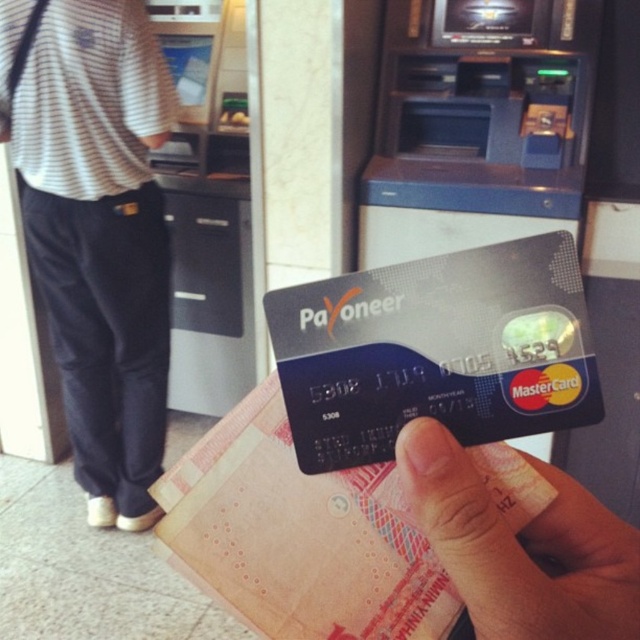
Question: Does striped cotton shirt at upper left appear over smooth skin hand at center?

Choices:
 (A) no
 (B) yes

Answer: (B)

Question: Is striped cotton shirt at upper left bigger than smooth skin hand at center?

Choices:
 (A) yes
 (B) no

Answer: (A)

Question: Can you confirm if striped cotton shirt at upper left is thinner than smooth skin hand at center?

Choices:
 (A) no
 (B) yes

Answer: (A)

Question: Which of the following is the farthest from the observer?

Choices:
 (A) (83, 467)
 (B) (564, 605)

Answer: (A)